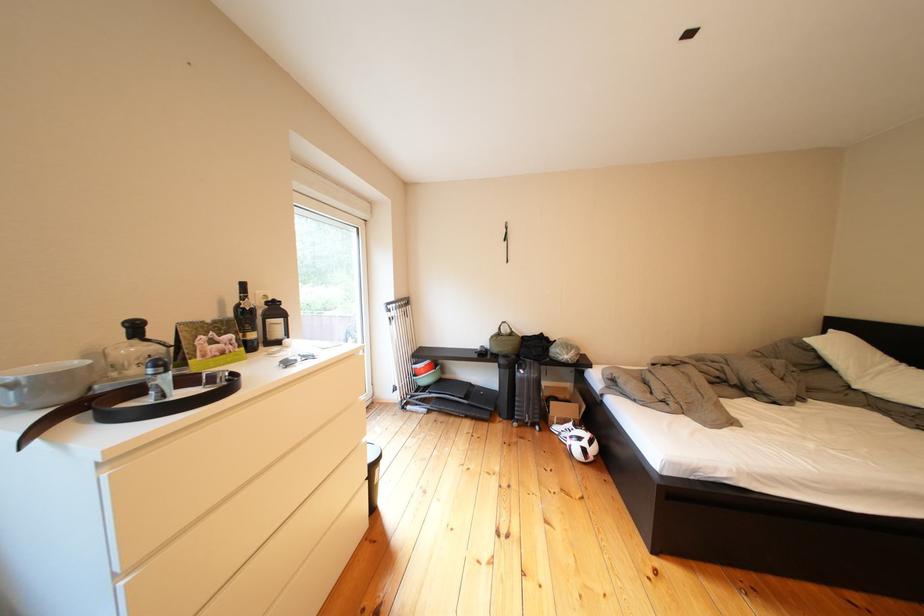
Where would you pull the black rolling suitcase? Please return your answer as a coordinate pair (x, y).

(528, 394)